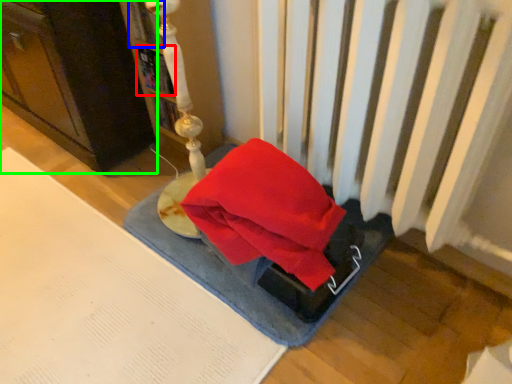
Question: Based on their relative distances, which object is nearer to book (highlighted by a red box)? Choose from book (highlighted by a blue box) and furniture (highlighted by a green box).

Choices:
 (A) book
 (B) furniture

Answer: (A)